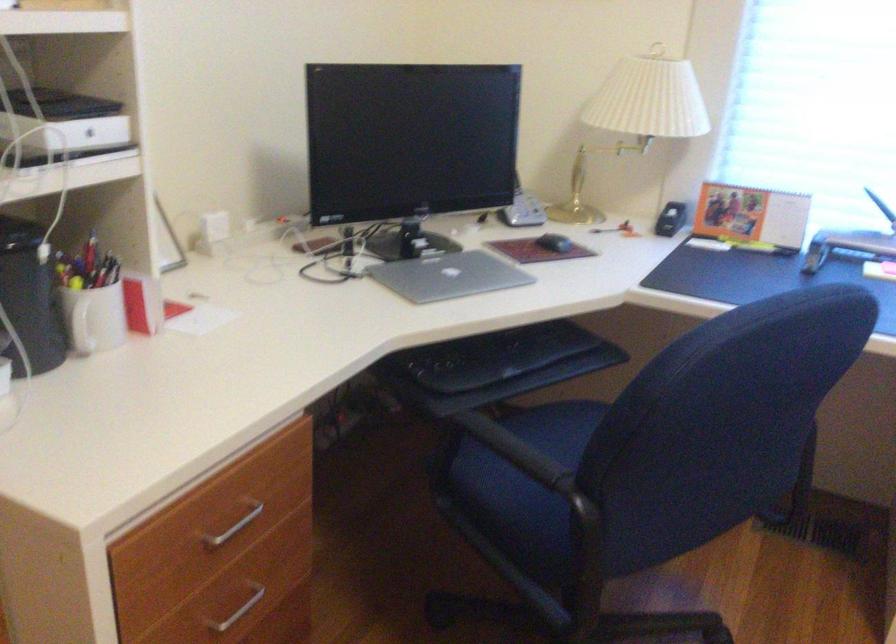
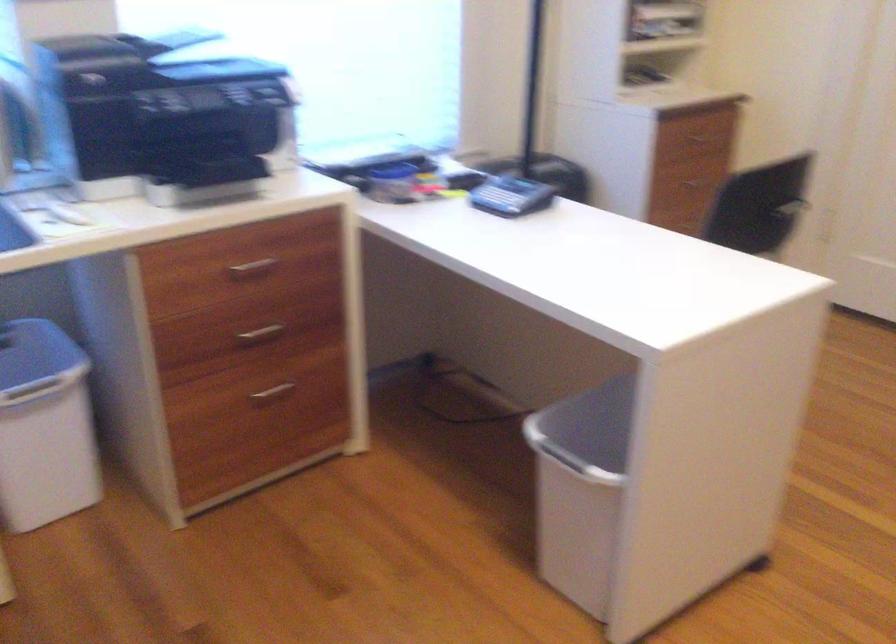
The first image is from the beginning of the video and the second image is from the end. How did the camera likely rotate when shooting the video?

The camera rotated toward right-down.